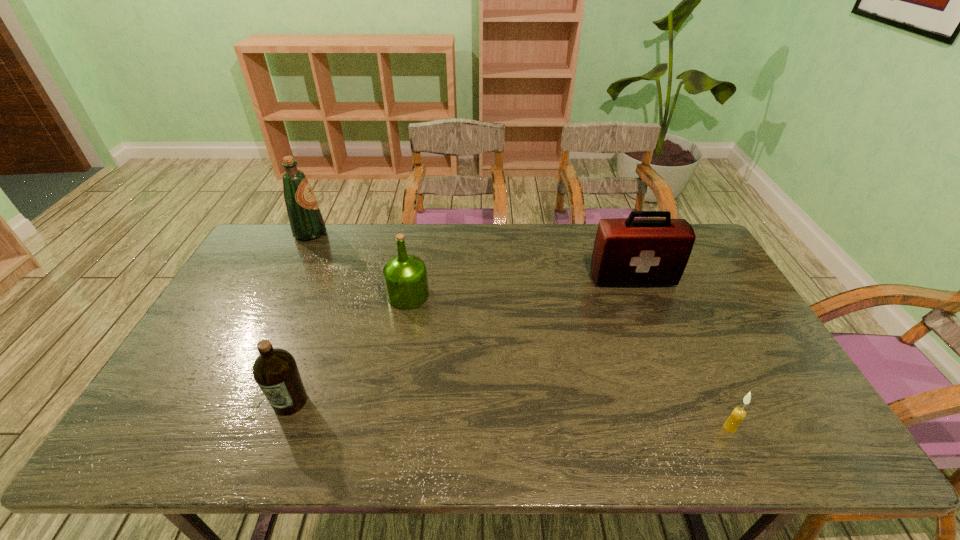
Identify the location of vacant area in the image that satisfies the following two spatial constraints: 1. on the front-facing side of the farthest olive oil; 2. on the right side of the candle. (213, 428).

The image size is (960, 540). What are the coordinates of `vacant region that satisfies the following two spatial constraints: 1. on the label of the nearest object; 2. on the right side of the second nearest object` in the screenshot? It's located at (280, 428).

You are a GUI agent. You are given a task and a screenshot of the screen. Output one action in this format:
    pyautogui.click(x=<x>, y=<y>)
    Task: Click on the vacant area in the image that satisfies the following two spatial constraints: 1. on the label of the second object from left to right; 2. on the left side of the shortest object
    
    Given the screenshot: What is the action you would take?
    pyautogui.click(x=280, y=428)

What are the coordinates of `free location that satisfies the following two spatial constraints: 1. on the side of the first aid kit with the cross symbol; 2. on the left side of the candle` in the screenshot? It's located at (691, 428).

I want to click on blank area in the image that satisfies the following two spatial constraints: 1. on the back side of the shortest object; 2. on the front-facing side of the leftmost object, so click(x=638, y=233).